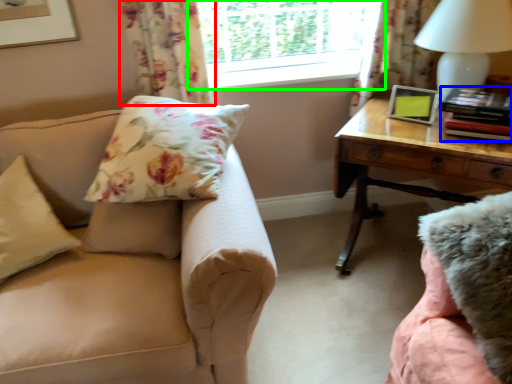
Question: Considering the real-world distances, which object is closest to curtain (highlighted by a red box)? book (highlighted by a blue box) or window (highlighted by a green box).

Choices:
 (A) book
 (B) window

Answer: (B)